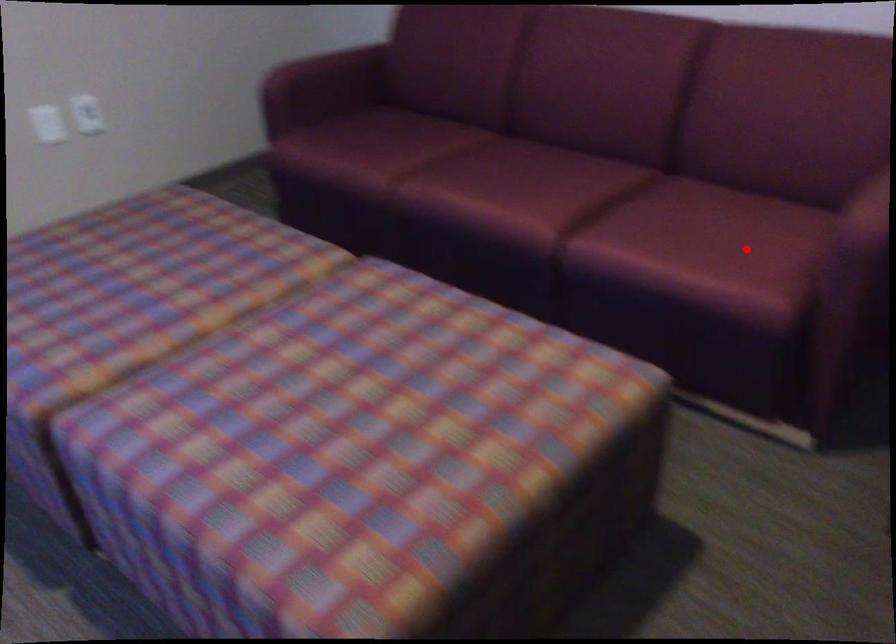
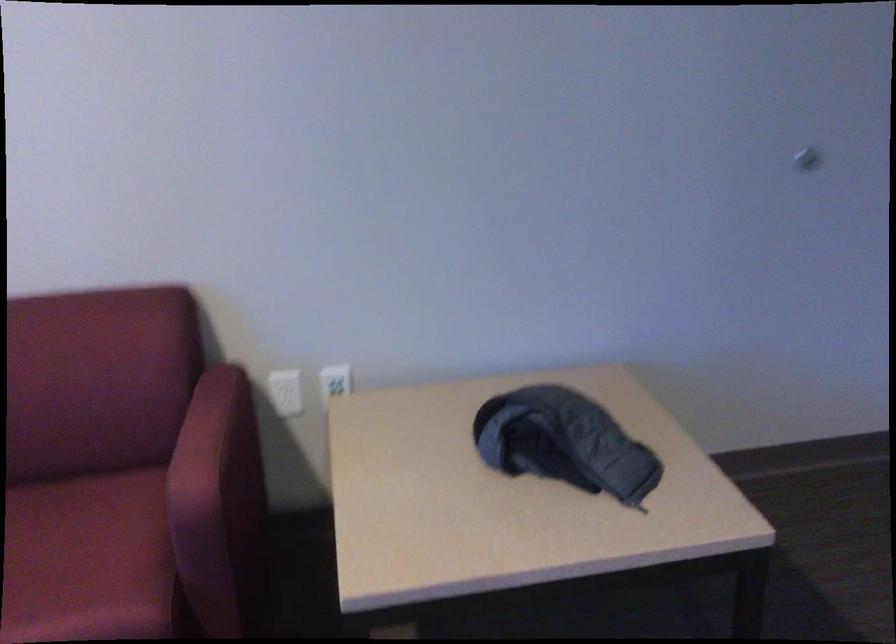
Question: I am providing you with two images of the same scene from different viewpoints. A red point is marked on the first image. Is the red point's position out of view in image 2?

Choices:
 (A) Yes
 (B) No

Answer: (B)